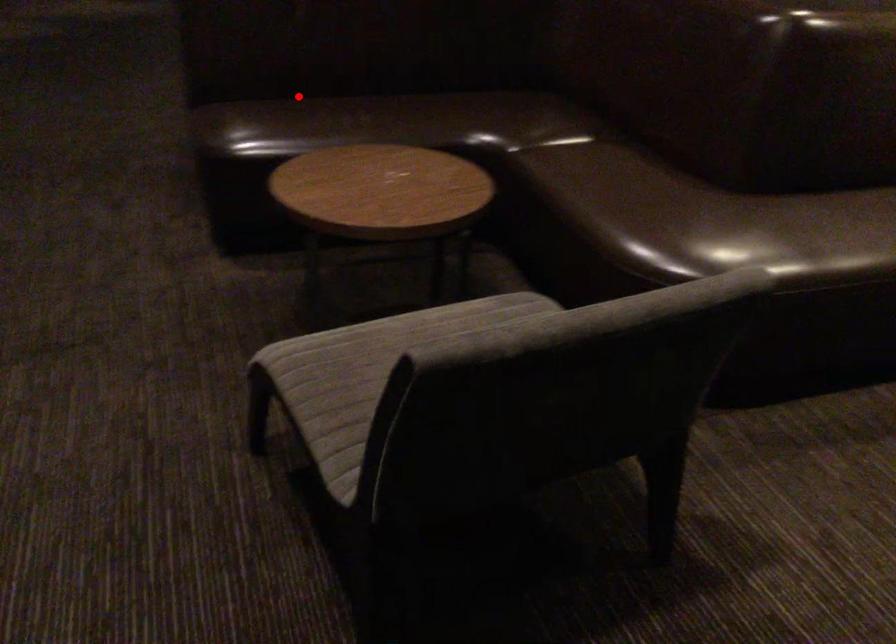
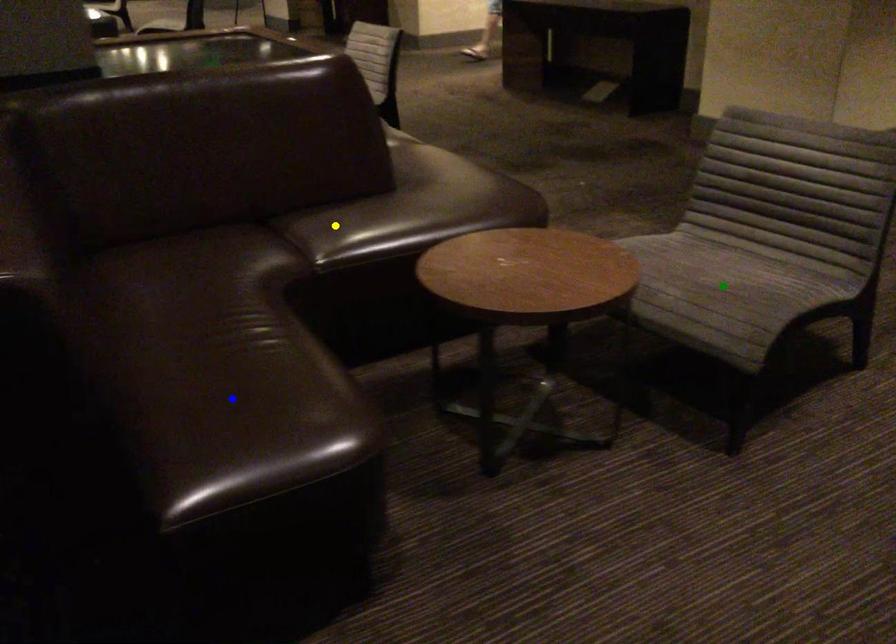
Question: I am providing you with two images of the same scene from different viewpoints. A red point is marked on the first image. You are given multiple points on the second image. Which point in image 2 is actually the same real-world point as the red point in image 1?

Choices:
 (A) green point
 (B) blue point
 (C) yellow point

Answer: (B)